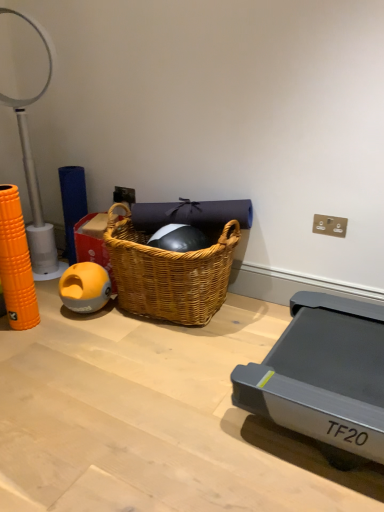
Question: Considering the relative sizes of white plastic table lamp at left and woven wood picnic basket at center in the image provided, is white plastic table lamp at left taller than woven wood picnic basket at center?

Choices:
 (A) yes
 (B) no

Answer: (A)

Question: From the image's perspective, is white plastic table lamp at left above woven wood picnic basket at center?

Choices:
 (A) yes
 (B) no

Answer: (A)

Question: Is white plastic table lamp at left next to woven wood picnic basket at center?

Choices:
 (A) yes
 (B) no

Answer: (B)

Question: Is white plastic table lamp at left to the right of woven wood picnic basket at center from the viewer's perspective?

Choices:
 (A) no
 (B) yes

Answer: (A)

Question: Does white plastic table lamp at left have a lesser height compared to woven wood picnic basket at center?

Choices:
 (A) no
 (B) yes

Answer: (A)

Question: Is white plastic table lamp at left at the left side of woven wood picnic basket at center?

Choices:
 (A) no
 (B) yes

Answer: (B)

Question: Is white plastic table lamp at left outside of wooden floor at lower left?

Choices:
 (A) no
 (B) yes

Answer: (B)

Question: Can you confirm if white plastic table lamp at left is smaller than wooden floor at lower left?

Choices:
 (A) no
 (B) yes

Answer: (A)

Question: Could you tell me if white plastic table lamp at left is turned towards wooden floor at lower left?

Choices:
 (A) yes
 (B) no

Answer: (B)

Question: Is white plastic table lamp at left far from wooden floor at lower left?

Choices:
 (A) yes
 (B) no

Answer: (A)

Question: From a real-world perspective, is white plastic table lamp at left under wooden floor at lower left?

Choices:
 (A) yes
 (B) no

Answer: (B)

Question: Is white plastic table lamp at left closer to the viewer compared to wooden floor at lower left?

Choices:
 (A) no
 (B) yes

Answer: (A)

Question: Can you confirm if woven wood picnic basket at center is thinner than yellow rubber ball at left?

Choices:
 (A) no
 (B) yes

Answer: (A)